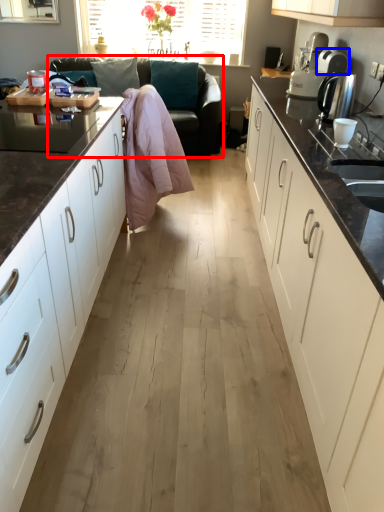
Question: Which object appears closest to the camera in this image, studio couch (highlighted by a red box) or appliance (highlighted by a blue box)?

Choices:
 (A) studio couch
 (B) appliance

Answer: (B)